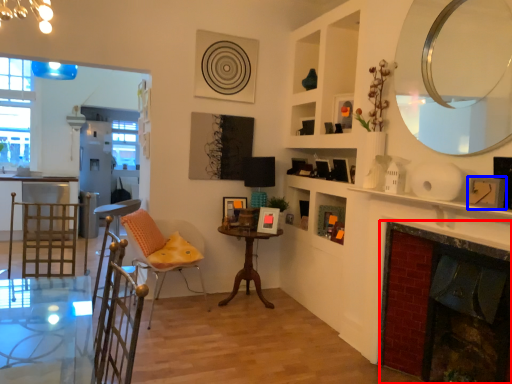
Question: Which object appears closest to the camera in this image, fireplace (highlighted by a red box) or picture frame (highlighted by a blue box)?

Choices:
 (A) fireplace
 (B) picture frame

Answer: (A)